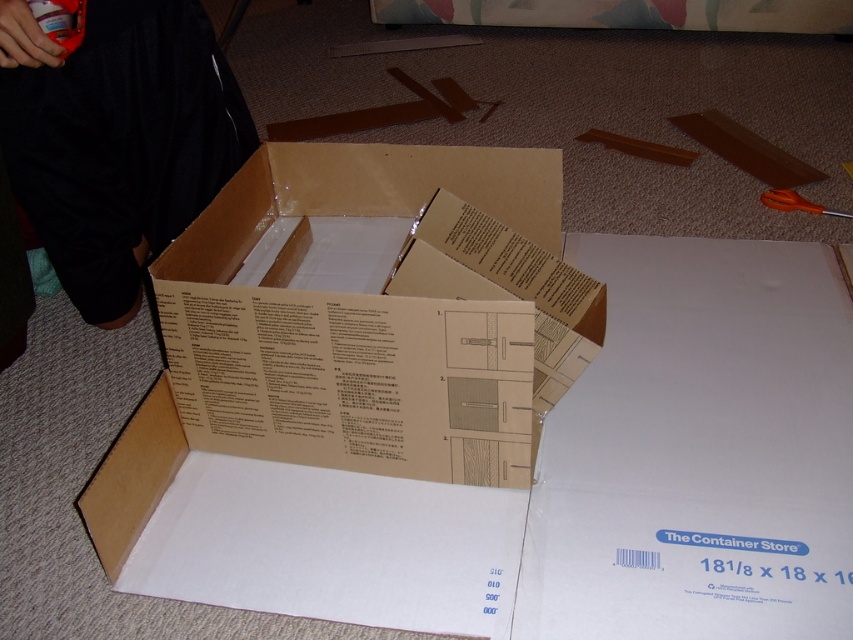
You are standing in a room and see a brown cardboard box at center. Can you determine if the box is placed to the left or right of the point at (378, 310)?

The brown cardboard box at center is represented by the point at (378, 310), so the box is exactly at that point.